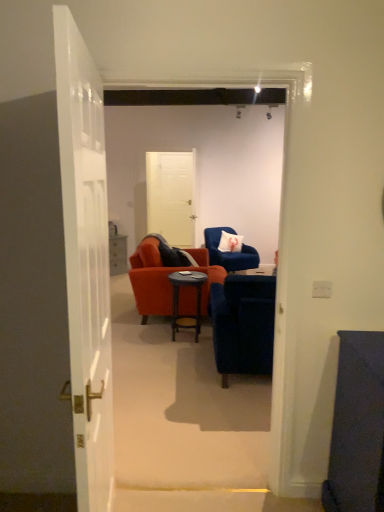
At what (x,y) coordinates should I click in order to perform the action: click on vacant space in front of velvet blue armchair at center, which appears as the 1th chair when viewed from the front. Please return your answer as a coordinate pair (x, y). Looking at the image, I should click on (213, 419).